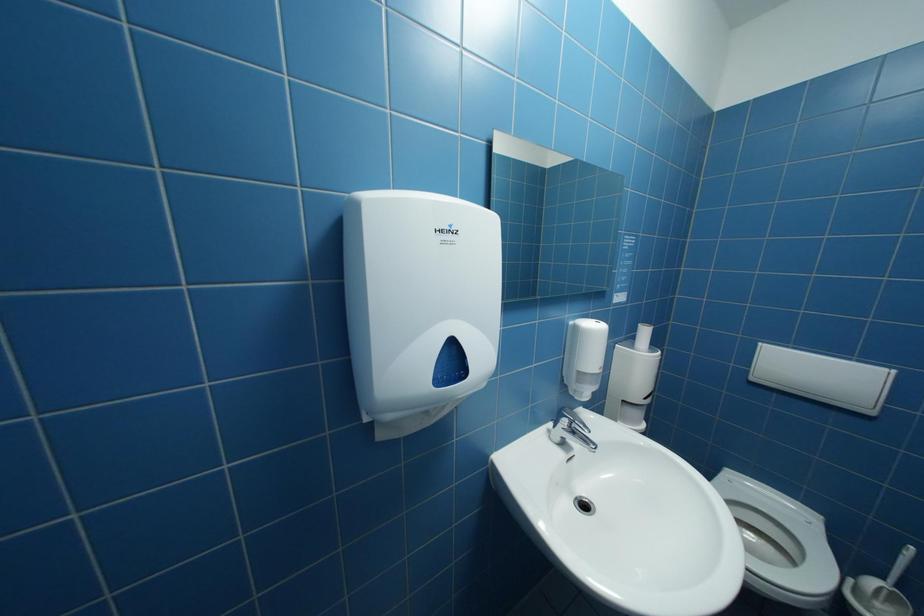
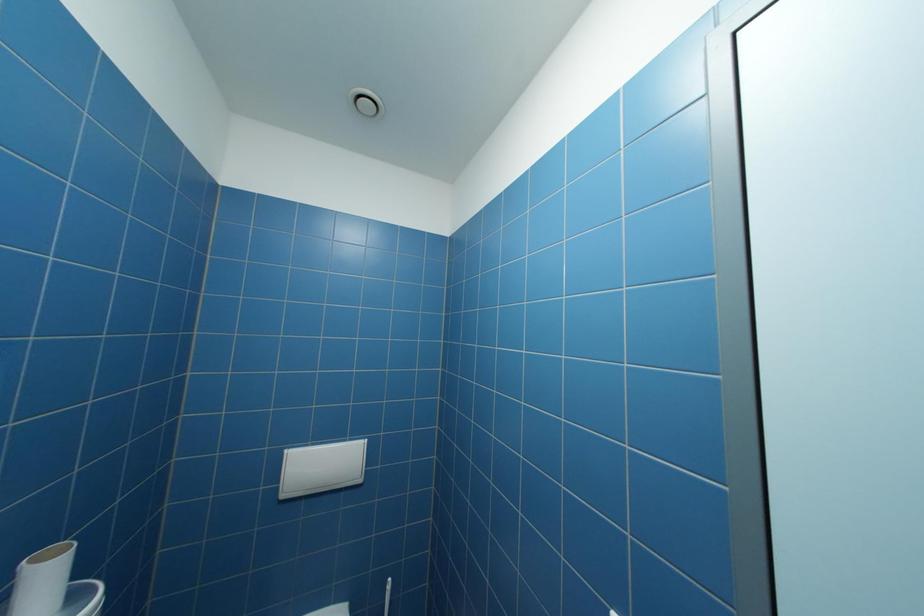
Question: How did the camera likely rotate?

Choices:
 (A) Left
 (B) Right
 (C) Up
 (D) Down

Answer: (B)